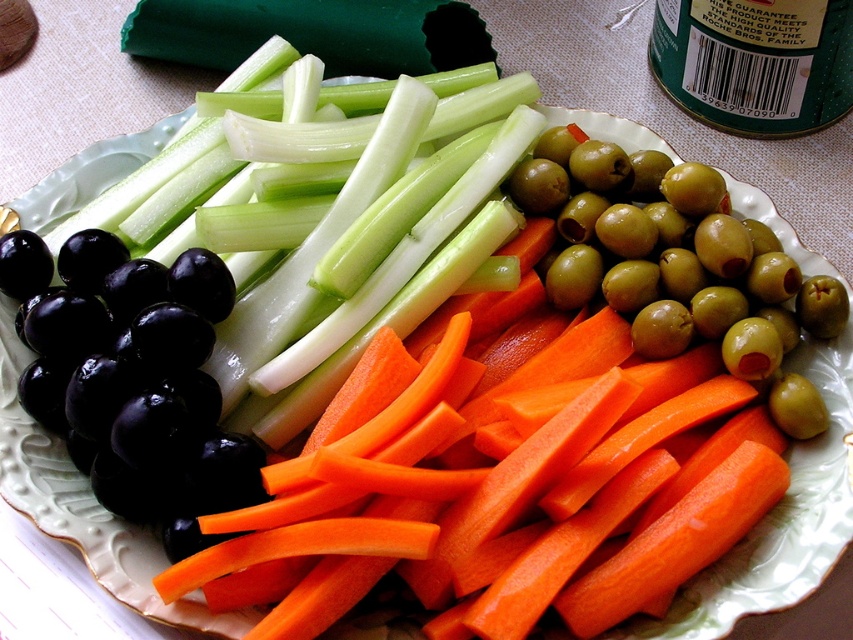
Based on the photo, you are arranging a snack platter and want to place a cheese cube between the shiny black grape at lower left and the green olive at upper right. Based on their positions, where should you place the cheese cube?

The cheese cube should be placed between the shiny black grape at lower left and the green olive at upper right, since the shiny black grape at lower left is to the left of the green olive at upper right, so the cheese cube should be placed in the middle between them along the horizontal axis.

You are a food stylist arranging vegetables on a plate. You have an orange smooth carrot at center and a green crisp celery at left. If you want to move the orange smooth carrot closer to the green crisp celery, which direction should you move it?

The orange smooth carrot at center is already closer to the viewer than the green crisp celery at left. To move it closer to the celery, you should move it backward, away from the viewer, so it aligns more with the position of the green crisp celery at left.

You are arranging a snack platter and want to place a bowl of dip between the orange smooth carrot at center and the green crisp celery at left. Based on their positions, where should you place the bowl of dip?

The orange smooth carrot at center is positioned under the green crisp celery at left, so the bowl of dip should be placed between them, closer to the orange smooth carrot at center since it is lower on the plate.